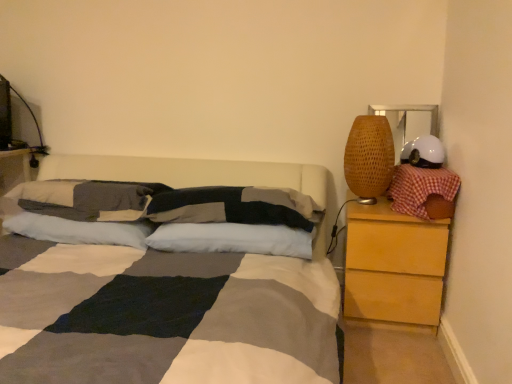
Question: Can you confirm if textured gray pillow at center, acting as the 3th pillow starting from the left, is positioned to the left of white soft pillow at center, which is the fourth pillow from left to right?

Choices:
 (A) yes
 (B) no

Answer: (A)

Question: From a real-world perspective, does textured gray pillow at center, acting as the third pillow starting from the right, sit lower than white soft pillow at center, which is the fourth pillow from left to right?

Choices:
 (A) no
 (B) yes

Answer: (A)

Question: Is textured gray pillow at center, acting as the 3th pillow starting from the left, at the right side of white soft pillow at center, acting as the second pillow starting from the right?

Choices:
 (A) no
 (B) yes

Answer: (A)

Question: From a real-world perspective, is textured gray pillow at center, acting as the 3th pillow starting from the left, physically above white soft pillow at center, which is the fourth pillow from left to right?

Choices:
 (A) yes
 (B) no

Answer: (A)

Question: Is textured gray pillow at center, acting as the 3th pillow starting from the left, facing away from white soft pillow at center, which is the fourth pillow from left to right?

Choices:
 (A) no
 (B) yes

Answer: (A)

Question: From the image's perspective, is light brown wood chest of drawers at right located above or below white matte helmet at upper right?

Choices:
 (A) below
 (B) above

Answer: (A)

Question: Considering the positions of light brown wood chest of drawers at right and white matte helmet at upper right in the image, is light brown wood chest of drawers at right bigger or smaller than white matte helmet at upper right?

Choices:
 (A) small
 (B) big

Answer: (B)

Question: Considering the positions of light brown wood chest of drawers at right and white matte helmet at upper right in the image, is light brown wood chest of drawers at right taller or shorter than white matte helmet at upper right?

Choices:
 (A) short
 (B) tall

Answer: (B)

Question: Choose the correct answer: Is light brown wood chest of drawers at right inside white matte helmet at upper right or outside it?

Choices:
 (A) outside
 (B) inside

Answer: (A)

Question: From the image's perspective, is textured gray pillow at center, acting as the third pillow starting from the right, positioned above or below light brown wood chest of drawers at right?

Choices:
 (A) below
 (B) above

Answer: (B)

Question: Does point (246, 198) appear closer or farther from the camera than point (394, 233)?

Choices:
 (A) farther
 (B) closer

Answer: (B)

Question: In terms of height, does textured gray pillow at center, acting as the third pillow starting from the right, look taller or shorter compared to light brown wood chest of drawers at right?

Choices:
 (A) short
 (B) tall

Answer: (A)

Question: From a real-world perspective, is textured gray pillow at center, acting as the third pillow starting from the right, positioned above or below light brown wood chest of drawers at right?

Choices:
 (A) below
 (B) above

Answer: (B)

Question: From the image's perspective, relative to woven bamboo lampshade at right, is white matte helmet at upper right above or below?

Choices:
 (A) above
 (B) below

Answer: (A)

Question: Is white matte helmet at upper right taller or shorter than woven bamboo lampshade at right?

Choices:
 (A) short
 (B) tall

Answer: (A)